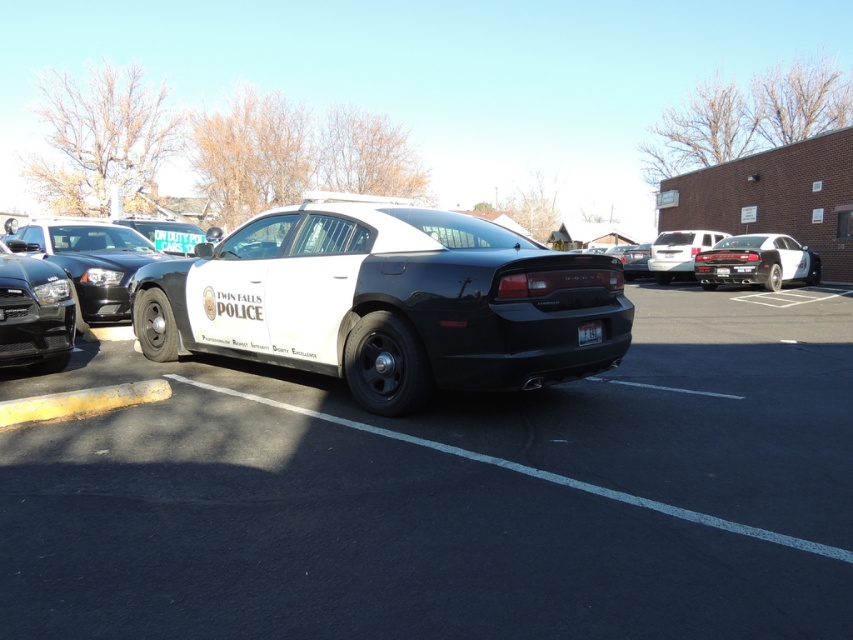
The height and width of the screenshot is (640, 853). What do you see at coordinates (386, 301) in the screenshot?
I see `black matte police car at center` at bounding box center [386, 301].

What do you see at coordinates (386, 301) in the screenshot? The height and width of the screenshot is (640, 853). I see `black matte police car at center` at bounding box center [386, 301].

Locate an element on the screen. Image resolution: width=853 pixels, height=640 pixels. black matte police car at center is located at coordinates (386, 301).

Identify the location of shiny black sedan at left. (90, 260).

Is shiny black sedan at left taller than white glossy sedan at right?

Indeed, shiny black sedan at left has a greater height compared to white glossy sedan at right.

Does point (117, 227) lie in front of point (735, 266)?

That is True.

Locate an element on the screen. shiny black sedan at left is located at coordinates (90, 260).

Which is above, black rubber car at center or white plastic license plate at center?

Positioned higher is white plastic license plate at center.

The width and height of the screenshot is (853, 640). What are the coordinates of `black rubber car at center` in the screenshot? It's located at (451, 493).